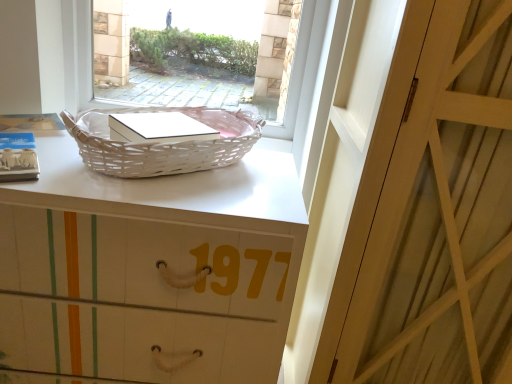
Question: From the image's perspective, is white wicker picnic basket at upper left above or below white wicker basket at upper center?

Choices:
 (A) below
 (B) above

Answer: (A)

Question: Considering the positions of white wicker picnic basket at upper left and white wicker basket at upper center in the image, is white wicker picnic basket at upper left taller or shorter than white wicker basket at upper center?

Choices:
 (A) tall
 (B) short

Answer: (B)

Question: Which of these objects is positioned closest to the white matte basket at upper center?

Choices:
 (A) white wicker picnic basket at upper left
 (B) white wicker basket at upper center
 (C) white wood door at center

Answer: (A)

Question: Which object is positioned closest to the white wicker basket at upper center?

Choices:
 (A) white matte basket at upper center
 (B) white wicker picnic basket at upper left
 (C) white wood door at center

Answer: (B)